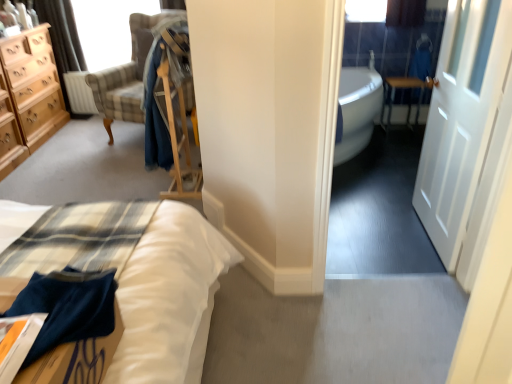
Question: Is blue cotton robe at center at the left side of matte beige curtain at upper left?

Choices:
 (A) no
 (B) yes

Answer: (A)

Question: From a real-world perspective, is blue cotton robe at center physically above matte beige curtain at upper left?

Choices:
 (A) no
 (B) yes

Answer: (B)

Question: From a real-world perspective, is blue cotton robe at center located beneath matte beige curtain at upper left?

Choices:
 (A) yes
 (B) no

Answer: (B)

Question: Is blue cotton robe at center wider than matte beige curtain at upper left?

Choices:
 (A) yes
 (B) no

Answer: (A)

Question: Are blue cotton robe at center and matte beige curtain at upper left beside each other?

Choices:
 (A) no
 (B) yes

Answer: (A)

Question: Can you confirm if blue cotton robe at center is thinner than matte beige curtain at upper left?

Choices:
 (A) yes
 (B) no

Answer: (B)

Question: Is light wood chest of drawers at left in contact with metallic silver table at right?

Choices:
 (A) yes
 (B) no

Answer: (B)

Question: Is light wood chest of drawers at left looking in the opposite direction of metallic silver table at right?

Choices:
 (A) no
 (B) yes

Answer: (A)

Question: Is light wood chest of drawers at left not near metallic silver table at right?

Choices:
 (A) no
 (B) yes

Answer: (B)

Question: Can you confirm if light wood chest of drawers at left is wider than metallic silver table at right?

Choices:
 (A) no
 (B) yes

Answer: (B)

Question: Does light wood chest of drawers at left have a greater height compared to metallic silver table at right?

Choices:
 (A) no
 (B) yes

Answer: (B)

Question: Considering the relative sizes of light wood chest of drawers at left and metallic silver table at right in the image provided, is light wood chest of drawers at left shorter than metallic silver table at right?

Choices:
 (A) no
 (B) yes

Answer: (A)

Question: Is matte beige curtain at upper left in contact with metallic silver table at right?

Choices:
 (A) yes
 (B) no

Answer: (B)